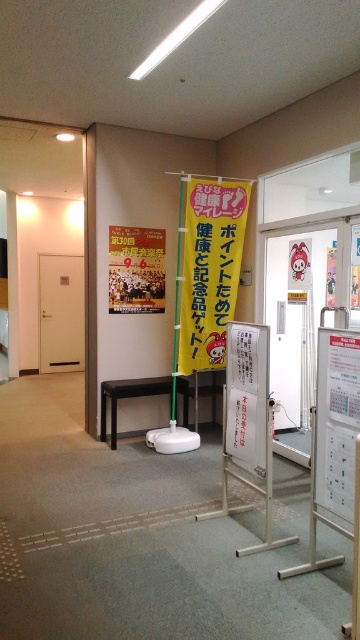
Can you confirm if yellow fabric banner at center is positioned to the right of white paper at center?

Incorrect, yellow fabric banner at center is not on the right side of white paper at center.

Describe the element at coordinates (209, 269) in the screenshot. I see `yellow fabric banner at center` at that location.

At what (x,y) coordinates should I click in order to perform the action: click on yellow fabric banner at center. Please return your answer as a coordinate pair (x, y). Image resolution: width=360 pixels, height=640 pixels. Looking at the image, I should click on (209, 269).

Locate an element on the screen. The width and height of the screenshot is (360, 640). yellow paper poster at center is located at coordinates (136, 269).

Can you confirm if yellow paper poster at center is wider than white paper at center?

Yes.

Is point (163, 256) farther from camera compared to point (244, 442)?

Yes, it is behind point (244, 442).

Image resolution: width=360 pixels, height=640 pixels. Identify the location of yellow paper poster at center. (136, 269).

Between white paperboard at center and yellow paper poster at center, which one has less height?

yellow paper poster at center is shorter.

Which is more to the left, white paperboard at center or yellow paper poster at center?

yellow paper poster at center is more to the left.

Is point (240, 426) positioned before point (155, 240)?

That is True.

At what (x,y) coordinates should I click in order to perform the action: click on white paperboard at center. Please return your answer as a coordinate pair (x, y). The height and width of the screenshot is (640, 360). Looking at the image, I should click on (246, 396).